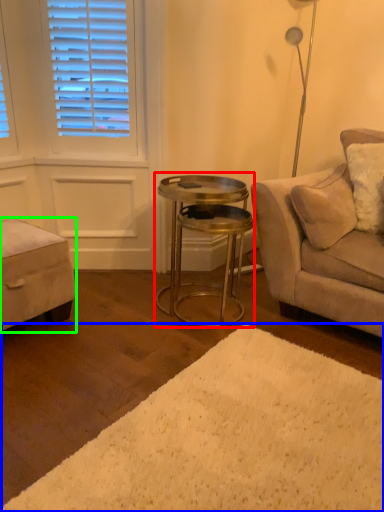
Question: Which object is the farthest from table (highlighted by a red box)? Choose among these: plain (highlighted by a blue box) or music stool (highlighted by a green box).

Choices:
 (A) plain
 (B) music stool

Answer: (A)